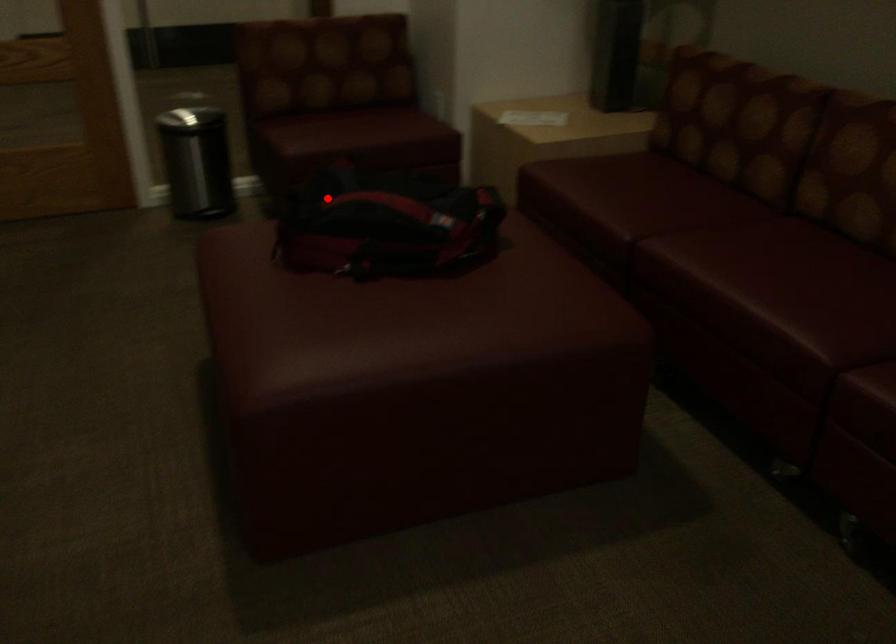
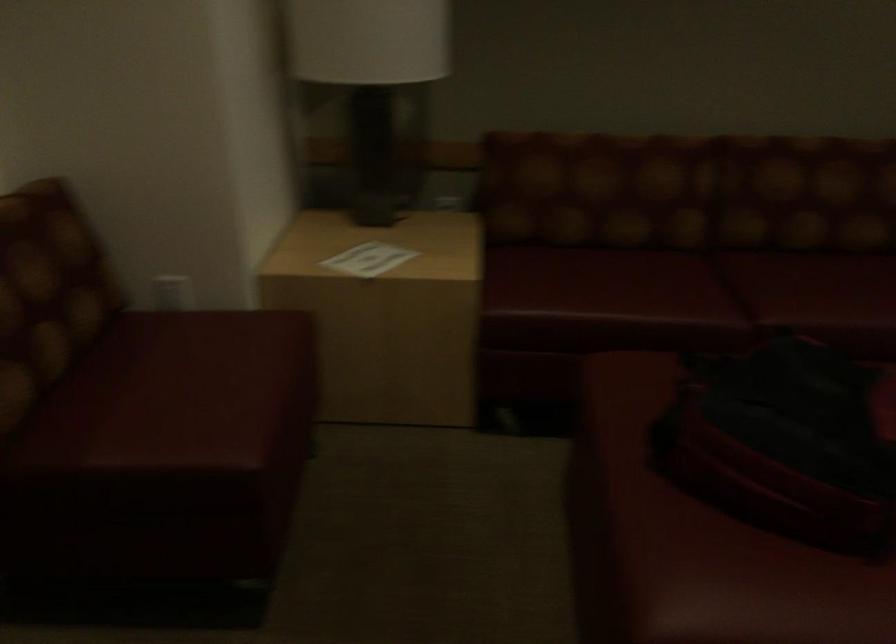
Locate, in the second image, the point that corresponds to the highlighted location in the first image.

(786, 442)